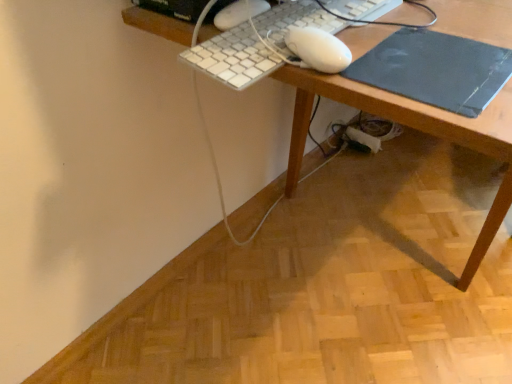
Question: Considering their positions, is black matte mousepad at right located in front of or behind wooden desk at center?

Choices:
 (A) front
 (B) behind

Answer: (B)

Question: In terms of height, does black matte mousepad at right look taller or shorter compared to wooden desk at center?

Choices:
 (A) short
 (B) tall

Answer: (A)

Question: Estimate the real-world distances between objects in this image. Which object is closer to the white plastic keyboard at upper center?

Choices:
 (A) black matte mousepad at right
 (B) wooden desk at center

Answer: (B)

Question: Estimate the real-world distances between objects in this image. Which object is farther from the wooden desk at center?

Choices:
 (A) white plastic keyboard at upper center
 (B) black matte mousepad at right

Answer: (A)